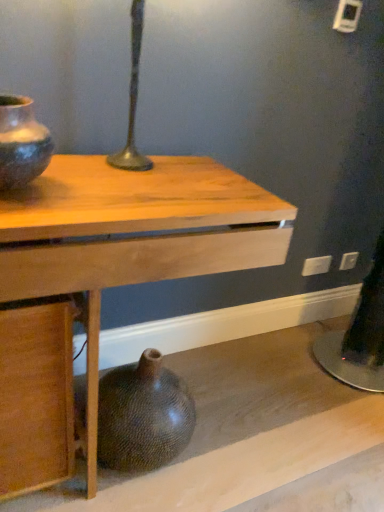
Question: Is matte black vase at left, positioned as the first vase in top-to-bottom order, to the left of brown textured vase at lower center, the second vase from the top, from the viewer's perspective?

Choices:
 (A) yes
 (B) no

Answer: (A)

Question: Can you confirm if matte black vase at left, marked as the first vase in a front-to-back arrangement, is positioned to the right of brown textured vase at lower center, the 2th vase from the front?

Choices:
 (A) yes
 (B) no

Answer: (B)

Question: Are matte black vase at left, which is counted as the 2th vase, starting from the bottom, and brown textured vase at lower center, the second vase from the top, beside each other?

Choices:
 (A) no
 (B) yes

Answer: (A)

Question: From a real-world perspective, is matte black vase at left, marked as the first vase in a front-to-back arrangement, under brown textured vase at lower center, the 2th vase from the front?

Choices:
 (A) yes
 (B) no

Answer: (B)

Question: Could you tell me if matte black vase at left, which is counted as the 2th vase, starting from the bottom, is facing brown textured vase at lower center, the second vase from the top?

Choices:
 (A) yes
 (B) no

Answer: (B)

Question: Is matte black vase at left, which is counted as the 2th vase, starting from the bottom, shorter than brown textured vase at lower center, the second vase from the top?

Choices:
 (A) no
 (B) yes

Answer: (B)

Question: Considering the relative positions of wooden table at center and white plastic electric outlet at lower right, which is counted as the first electric outlet, starting from the front, in the image provided, is wooden table at center to the left of white plastic electric outlet at lower right, which is counted as the first electric outlet, starting from the front, from the viewer's perspective?

Choices:
 (A) no
 (B) yes

Answer: (B)

Question: From the image's perspective, is wooden table at center over white plastic electric outlet at lower right, the 2th electric outlet in the right-to-left sequence?

Choices:
 (A) no
 (B) yes

Answer: (A)

Question: Is wooden table at center in contact with white plastic electric outlet at lower right, which is counted as the first electric outlet, starting from the front?

Choices:
 (A) yes
 (B) no

Answer: (B)

Question: From a real-world perspective, is wooden table at center over white plastic electric outlet at lower right, the 2th electric outlet in the right-to-left sequence?

Choices:
 (A) no
 (B) yes

Answer: (B)

Question: Considering the relative sizes of wooden table at center and white plastic electric outlet at lower right, which appears as the 2th electric outlet when viewed from the back, in the image provided, is wooden table at center wider than white plastic electric outlet at lower right, which appears as the 2th electric outlet when viewed from the back,?

Choices:
 (A) yes
 (B) no

Answer: (A)

Question: Is wooden table at center in front of white plastic electric outlet at lower right, the 2th electric outlet in the right-to-left sequence?

Choices:
 (A) yes
 (B) no

Answer: (A)

Question: Is white plastic electric outlet at lower right, the 2th electric outlet in the right-to-left sequence, taller than brown textured vase at lower center, the first vase viewed from the back?

Choices:
 (A) no
 (B) yes

Answer: (A)